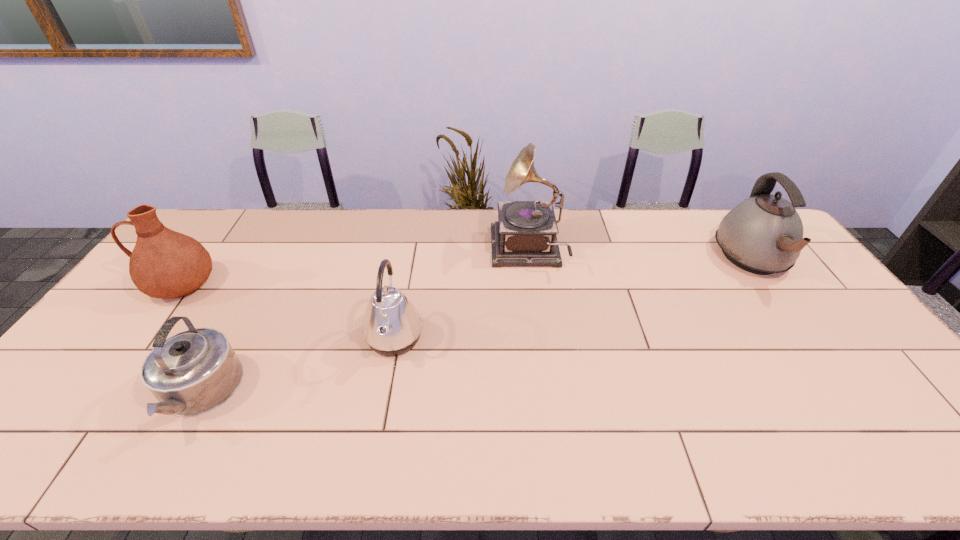
This screenshot has width=960, height=540. Identify the location of the tallest object. (525, 234).

Where is `record player`? This screenshot has height=540, width=960. record player is located at coordinates (525, 234).

At what (x,y) coordinates should I click in order to perform the action: click on the farthest kettle. Please return your answer as a coordinate pair (x, y). The width and height of the screenshot is (960, 540). Looking at the image, I should click on (763, 234).

This screenshot has width=960, height=540. Identify the location of the rightmost kettle. (763, 234).

Locate an element on the screen. The width and height of the screenshot is (960, 540). pitcher is located at coordinates (164, 264).

Identify the location of the third object from left to right. This screenshot has height=540, width=960. (392, 326).

This screenshot has width=960, height=540. In order to click on the leftmost kettle in this screenshot , I will do `click(193, 372)`.

You are a GUI agent. You are given a task and a screenshot of the screen. Output one action in this format:
    pyautogui.click(x=<x>, y=<y>)
    Task: Click on the second object from left to right
    This screenshot has height=540, width=960.
    Given the screenshot: What is the action you would take?
    click(x=193, y=372)

Where is `vacant area situated 0.090m on the horn of the record player`? The height and width of the screenshot is (540, 960). vacant area situated 0.090m on the horn of the record player is located at coordinates (465, 251).

Image resolution: width=960 pixels, height=540 pixels. Identify the location of blank space located on the horn of the record player. (462, 251).